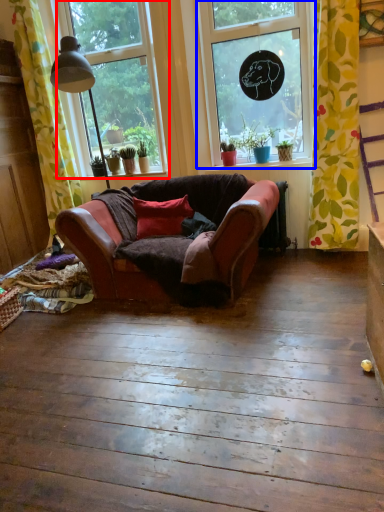
Question: Which object appears farthest to the camera in this image, window (highlighted by a red box) or window (highlighted by a blue box)?

Choices:
 (A) window
 (B) window

Answer: (A)